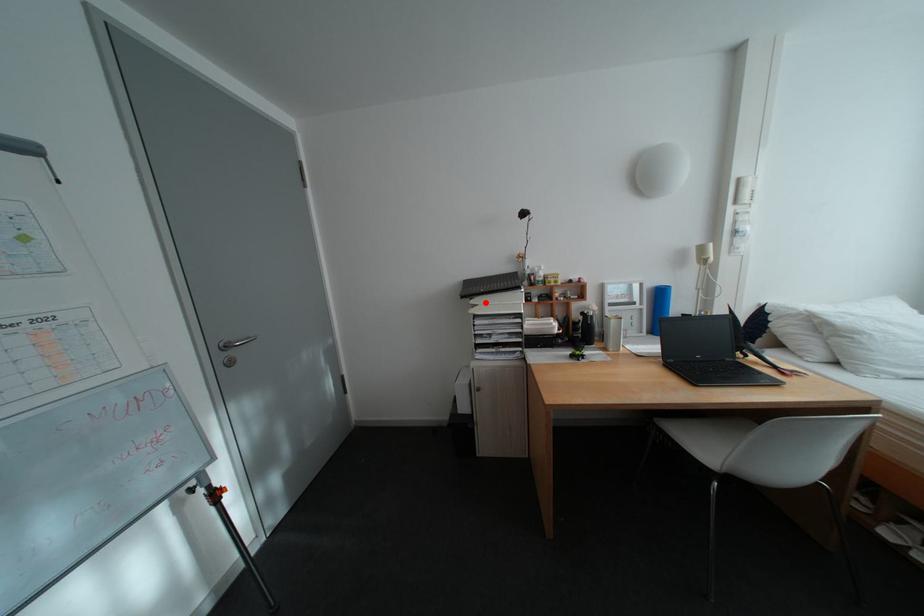
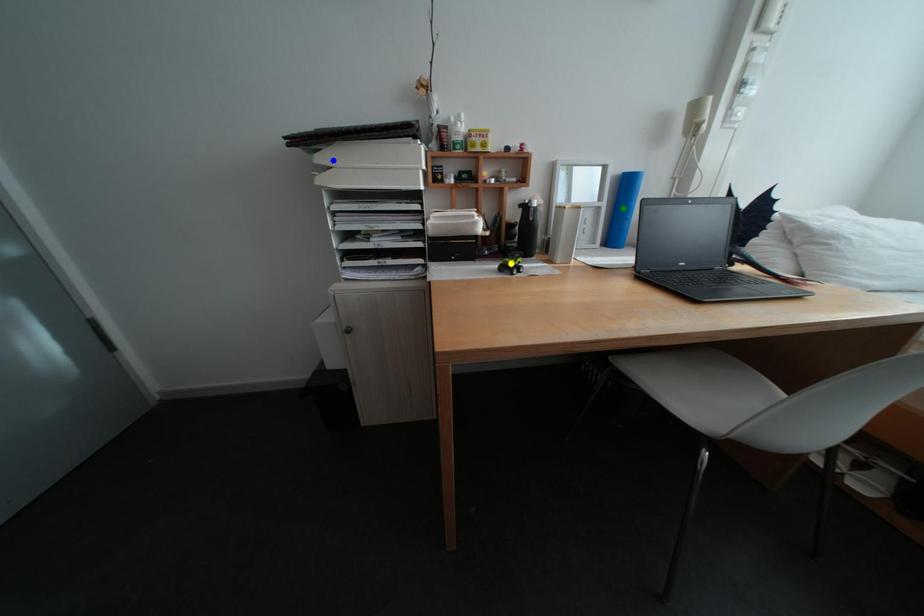
Question: I am providing you with two images of the same scene from different viewpoints. A red point is marked on the first image. You are given multiple points on the second image. Which spot in image 2 lines up with the point in image 1?

Choices:
 (A) green point
 (B) blue point
 (C) yellow point

Answer: (B)